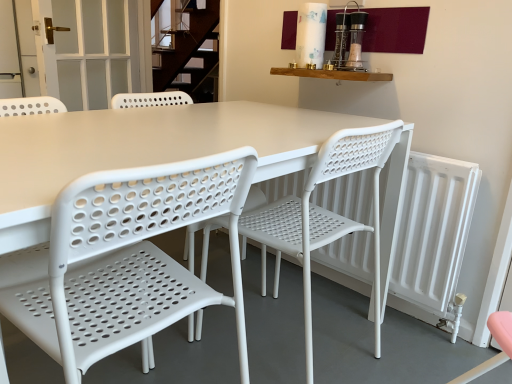
Question: Do you think white plastic chair at center, placed as the first chair when sorted from left to right, is within white frosted glass door at upper left, or outside of it?

Choices:
 (A) inside
 (B) outside

Answer: (B)

Question: In the image, is white plastic chair at center, placed as the first chair when sorted from left to right, positioned in front of or behind white frosted glass door at upper left?

Choices:
 (A) front
 (B) behind

Answer: (A)

Question: Based on their relative distances, which object is farther from the white plastic chair at center, placed as the first chair when sorted from left to right?

Choices:
 (A) white frosted glass door at upper left
 (B) white matte radiator at right
 (C) white plastic chair at center, placed as the 1th chair when sorted from right to left

Answer: (A)

Question: Based on their relative distances, which object is nearer to the white matte radiator at right?

Choices:
 (A) white plastic chair at center, placed as the first chair when sorted from left to right
 (B) white plastic chair at center, the 2th chair from the left
 (C) white frosted glass door at upper left

Answer: (B)